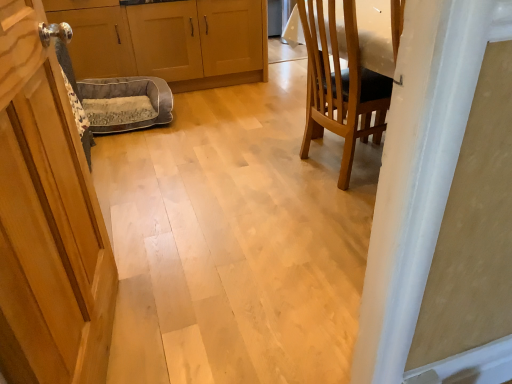
Where is `vacant area that lies to the right of wooden door at left`? vacant area that lies to the right of wooden door at left is located at coordinates (226, 325).